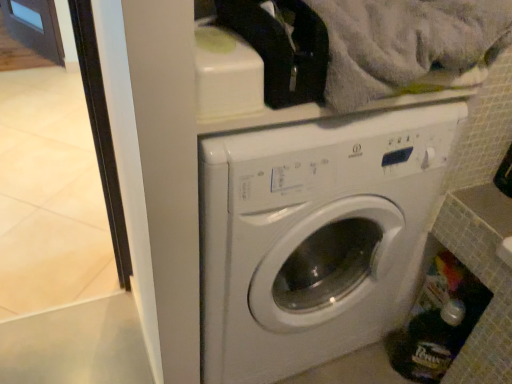
This screenshot has height=384, width=512. What do you see at coordinates (314, 237) in the screenshot? I see `white glossy washing machine at center` at bounding box center [314, 237].

You are a GUI agent. You are given a task and a screenshot of the screen. Output one action in this format:
    pyautogui.click(x=<x>, y=<y>)
    Task: Click on the white glossy washing machine at center
    This screenshot has height=384, width=512.
    Given the screenshot: What is the action you would take?
    pyautogui.click(x=314, y=237)

Where is `translucent plastic bottle at lower right`? The width and height of the screenshot is (512, 384). translucent plastic bottle at lower right is located at coordinates click(x=430, y=343).

What do you see at coordinates (430, 343) in the screenshot?
I see `translucent plastic bottle at lower right` at bounding box center [430, 343].

Where is `white glossy washing machine at center`? Image resolution: width=512 pixels, height=384 pixels. white glossy washing machine at center is located at coordinates (314, 237).

Which object is positioned more to the left, white glossy washing machine at center or translucent plastic bottle at lower right?

Positioned to the left is white glossy washing machine at center.

Is the depth of white glossy washing machine at center less than that of translucent plastic bottle at lower right?

Yes, it is.

Does point (234, 279) lie behind point (455, 345)?

No, (234, 279) is closer to viewer.

From the image's perspective, would you say white glossy washing machine at center is shown under translucent plastic bottle at lower right?

No, from the image's perspective, white glossy washing machine at center is not beneath translucent plastic bottle at lower right.

From a real-world perspective, is white glossy washing machine at center located beneath translucent plastic bottle at lower right?

No, from a real-world perspective, white glossy washing machine at center is not below translucent plastic bottle at lower right.

Is white glossy washing machine at center wider than translucent plastic bottle at lower right?

Yes.

Can you confirm if white glossy washing machine at center is shorter than translucent plastic bottle at lower right?

In fact, white glossy washing machine at center may be taller than translucent plastic bottle at lower right.

Can you confirm if white glossy washing machine at center is smaller than translucent plastic bottle at lower right?

Incorrect, white glossy washing machine at center is not smaller in size than translucent plastic bottle at lower right.

Do you think white glossy washing machine at center is within translucent plastic bottle at lower right, or outside of it?

white glossy washing machine at center is spatially situated outside translucent plastic bottle at lower right.

Is the surface of white glossy washing machine at center in direct contact with translucent plastic bottle at lower right?

white glossy washing machine at center and translucent plastic bottle at lower right are clearly separated.

Is translucent plastic bottle at lower right at the back of white glossy washing machine at center?

No, translucent plastic bottle at lower right is not at the back of white glossy washing machine at center.

What's the angular difference between white glossy washing machine at center and translucent plastic bottle at lower right's facing directions?

They differ by 40.1 degrees in their facing directions.

Where is `bottle below the white glossy washing machine at center (from a real-world perspective)`? This screenshot has width=512, height=384. bottle below the white glossy washing machine at center (from a real-world perspective) is located at coordinates (430, 343).

Between translucent plastic bottle at lower right and white glossy washing machine at center, which one appears on the left side from the viewer's perspective?

Positioned to the left is white glossy washing machine at center.

Considering the positions of objects translucent plastic bottle at lower right and white glossy washing machine at center in the image provided, who is in front, translucent plastic bottle at lower right or white glossy washing machine at center?

Positioned in front is white glossy washing machine at center.

Is point (435, 365) less distant than point (395, 176)?

That is False.

In the scene shown: From the image's perspective, does translucent plastic bottle at lower right appear lower than white glossy washing machine at center?

Correct, translucent plastic bottle at lower right appears lower than white glossy washing machine at center in the image.

From a real-world perspective, is translucent plastic bottle at lower right positioned over white glossy washing machine at center based on gravity?

No, from a real-world perspective, translucent plastic bottle at lower right is not above white glossy washing machine at center.

Which object is wider, translucent plastic bottle at lower right or white glossy washing machine at center?

With larger width is white glossy washing machine at center.

Is translucent plastic bottle at lower right shorter than white glossy washing machine at center?

Indeed, translucent plastic bottle at lower right has a lesser height compared to white glossy washing machine at center.

Can you confirm if translucent plastic bottle at lower right is bigger than white glossy washing machine at center?

No, translucent plastic bottle at lower right is not bigger than white glossy washing machine at center.

Is white glossy washing machine at center located within translucent plastic bottle at lower right?

No, white glossy washing machine at center is not inside translucent plastic bottle at lower right.

Is translucent plastic bottle at lower right in contact with white glossy washing machine at center?

translucent plastic bottle at lower right and white glossy washing machine at center are not in contact.

Could you tell me if translucent plastic bottle at lower right is turned towards white glossy washing machine at center?

No, translucent plastic bottle at lower right is not aimed at white glossy washing machine at center.

Can you tell me how much translucent plastic bottle at lower right and white glossy washing machine at center differ in facing direction?

The angle between the facing direction of translucent plastic bottle at lower right and the facing direction of white glossy washing machine at center is 40.1 degrees.

How much distance is there between translucent plastic bottle at lower right and white glossy washing machine at center?

translucent plastic bottle at lower right is 15.50 inches from white glossy washing machine at center.

Locate an element on the screen. bottle on the right of white glossy washing machine at center is located at coordinates (430, 343).

The width and height of the screenshot is (512, 384). Find the location of `bottle below the white glossy washing machine at center (from a real-world perspective)`. bottle below the white glossy washing machine at center (from a real-world perspective) is located at coordinates (430, 343).

You are a GUI agent. You are given a task and a screenshot of the screen. Output one action in this format:
    pyautogui.click(x=<x>, y=<y>)
    Task: Click on the washing machine above the translucent plastic bottle at lower right (from the image's perspective)
    This screenshot has height=384, width=512.
    Given the screenshot: What is the action you would take?
    pyautogui.click(x=314, y=237)